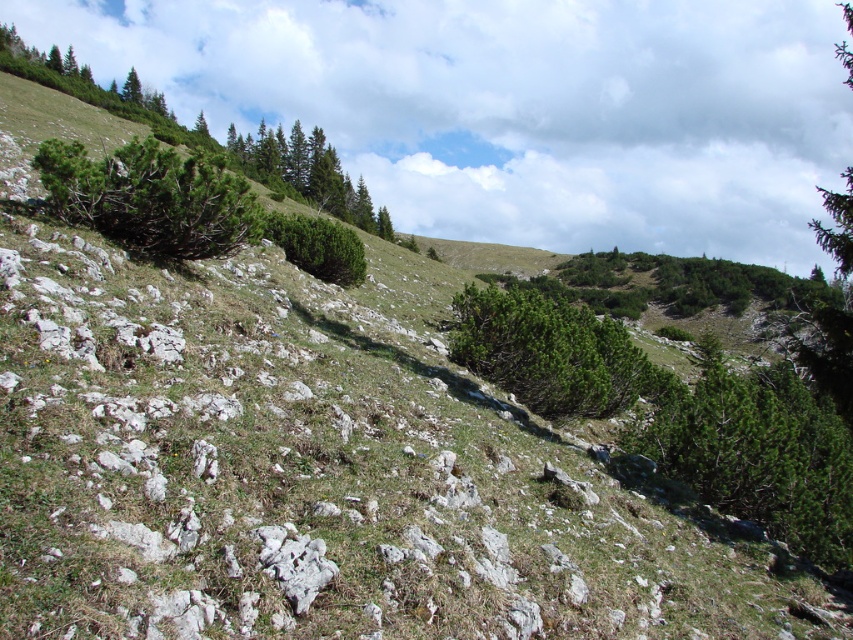
Is green matte tree at right bigger than green rough textured bush at upper left?

Yes, green matte tree at right is bigger than green rough textured bush at upper left.

Where is `green matte tree at right`? green matte tree at right is located at coordinates (756, 452).

Between point (541, 301) and point (126, 77), which one is positioned in front?

Point (541, 301) is in front.

Can you confirm if green matte tree at center is positioned below green matte tree at upper left?

Yes.

Where is `green matte tree at center`? The image size is (853, 640). green matte tree at center is located at coordinates (554, 353).

At what (x,y) coordinates should I click in order to perform the action: click on green matte tree at center. Please return your answer as a coordinate pair (x, y). This screenshot has height=640, width=853. Looking at the image, I should click on (554, 353).

Does green matte tree at right appear on the right side of green matte tree at center?

Indeed, green matte tree at right is positioned on the right side of green matte tree at center.

Looking at this image, does green matte tree at right have a lesser height compared to green matte tree at center?

Yes.

Locate an element on the screen. This screenshot has width=853, height=640. green matte tree at right is located at coordinates (756, 452).